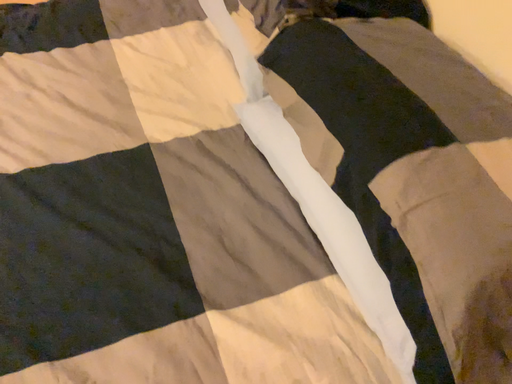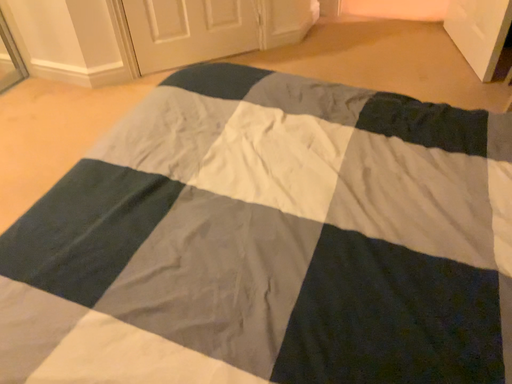
Question: How did the camera likely rotate when shooting the video?

Choices:
 (A) rotated right
 (B) rotated left

Answer: (B)